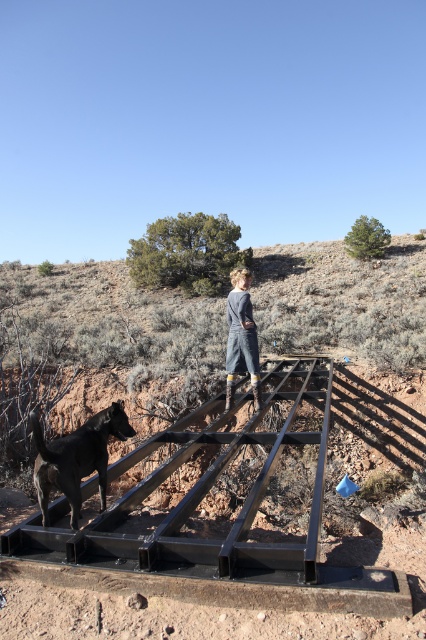
Question: Considering the real-world distances, which object is closest to the shiny black dog at lower left?

Choices:
 (A) denim dress at center
 (B) brown dirt hillside at upper center

Answer: (A)

Question: Which point is farther to the camera?

Choices:
 (A) (25, 554)
 (B) (42, 497)
 (C) (249, 371)

Answer: (C)

Question: Is black metal rail at center to the right of shiny black dog at lower left from the viewer's perspective?

Choices:
 (A) yes
 (B) no

Answer: (A)

Question: Can you confirm if shiny black dog at lower left is positioned below denim dress at center?

Choices:
 (A) no
 (B) yes

Answer: (B)

Question: Which object is positioned closest to the shiny black dog at lower left?

Choices:
 (A) denim dress at center
 (B) black metal rail at center

Answer: (A)

Question: Is brown dirt hillside at upper center bigger than denim dress at center?

Choices:
 (A) yes
 (B) no

Answer: (A)